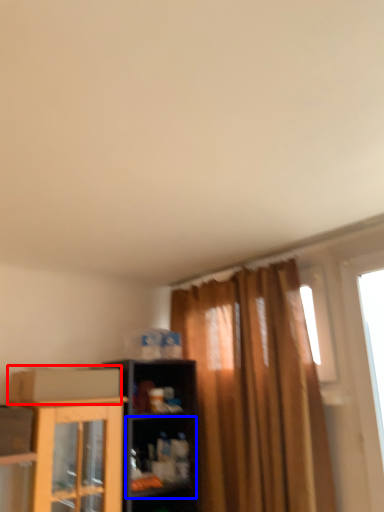
Question: Among these objects, which one is farthest to the camera, cardboard box (highlighted by a red box) or shelf (highlighted by a blue box)?

Choices:
 (A) cardboard box
 (B) shelf

Answer: (B)